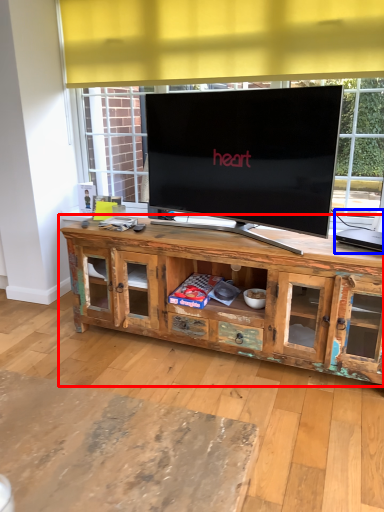
Question: Which object is closer to the camera taking this photo, cabinetry (highlighted by a red box) or computer (highlighted by a blue box)?

Choices:
 (A) cabinetry
 (B) computer

Answer: (A)